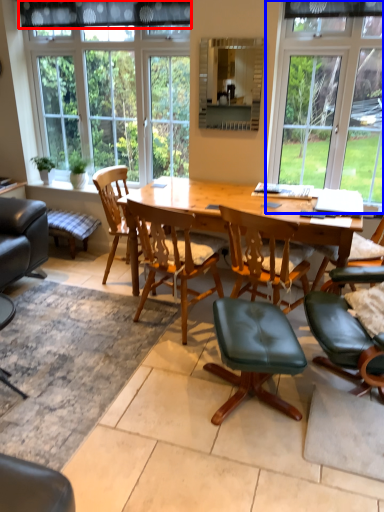
Question: Which point is closer to the camera, curtain (highlighted by a red box) or window (highlighted by a blue box)?

Choices:
 (A) curtain
 (B) window

Answer: (B)